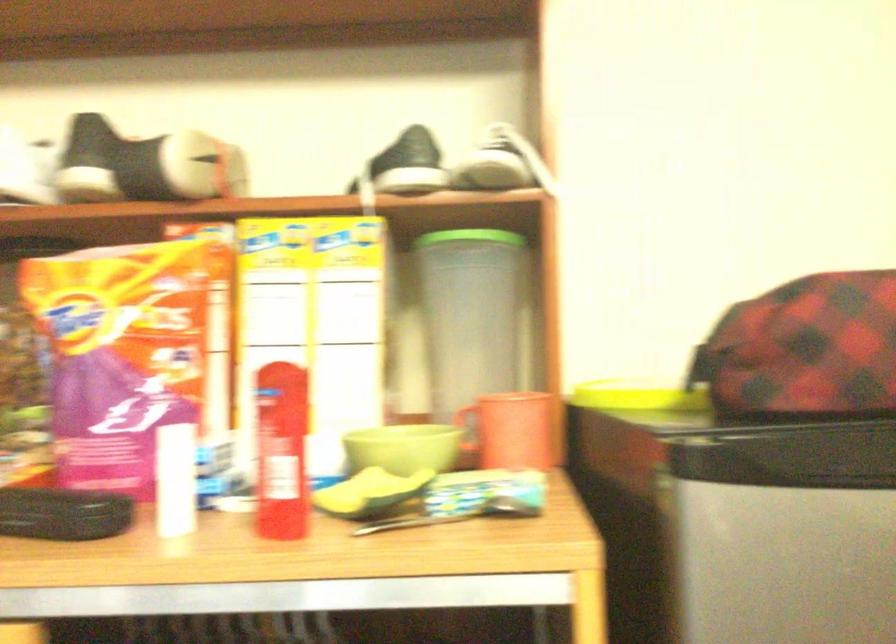
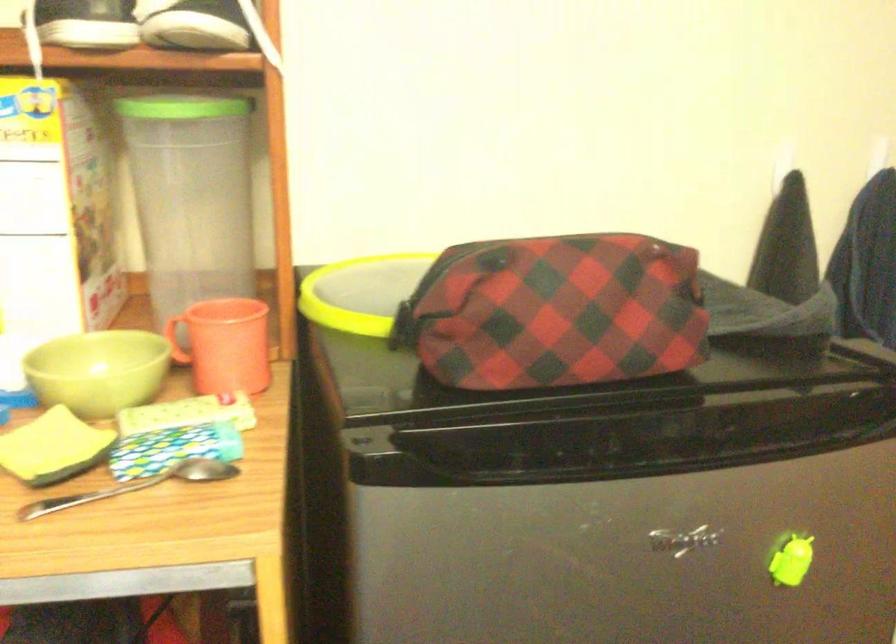
The point at (497,163) is marked in the first image. Where is the corresponding point in the second image?

(197, 26)